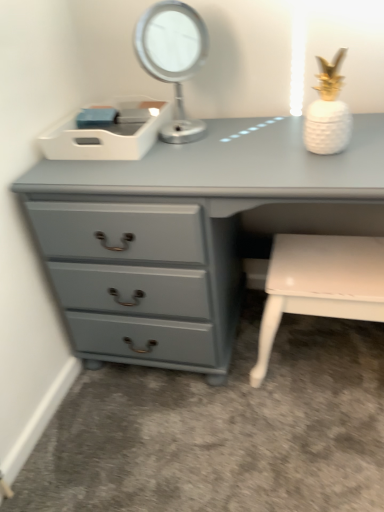
Question: Considering the relative sizes of metallic silver table lamp at upper center and matte gray chest of drawers at center in the image provided, is metallic silver table lamp at upper center taller than matte gray chest of drawers at center?

Choices:
 (A) no
 (B) yes

Answer: (A)

Question: Is metallic silver table lamp at upper center oriented away from matte gray chest of drawers at center?

Choices:
 (A) no
 (B) yes

Answer: (A)

Question: From a real-world perspective, is metallic silver table lamp at upper center physically below matte gray chest of drawers at center?

Choices:
 (A) yes
 (B) no

Answer: (B)

Question: Is metallic silver table lamp at upper center positioned before matte gray chest of drawers at center?

Choices:
 (A) no
 (B) yes

Answer: (A)

Question: Is metallic silver table lamp at upper center positioned behind matte gray chest of drawers at center?

Choices:
 (A) yes
 (B) no

Answer: (A)

Question: Does metallic silver table lamp at upper center have a lesser width compared to matte gray chest of drawers at center?

Choices:
 (A) no
 (B) yes

Answer: (B)

Question: Can you confirm if white glossy bench at lower right is positioned to the left of matte gray chest of drawers at center?

Choices:
 (A) yes
 (B) no

Answer: (B)

Question: From a real-world perspective, does white glossy bench at lower right stand above matte gray chest of drawers at center?

Choices:
 (A) no
 (B) yes

Answer: (A)

Question: Is white glossy bench at lower right outside of matte gray chest of drawers at center?

Choices:
 (A) yes
 (B) no

Answer: (B)

Question: Could you tell me if white glossy bench at lower right is facing matte gray chest of drawers at center?

Choices:
 (A) yes
 (B) no

Answer: (A)

Question: Is matte gray chest of drawers at center a part of white glossy bench at lower right?

Choices:
 (A) no
 (B) yes

Answer: (A)

Question: From the image's perspective, is white glossy bench at lower right located above matte gray chest of drawers at center?

Choices:
 (A) no
 (B) yes

Answer: (A)

Question: Is matte gray chest of drawers at center at the right side of white glossy bench at lower right?

Choices:
 (A) no
 (B) yes

Answer: (A)